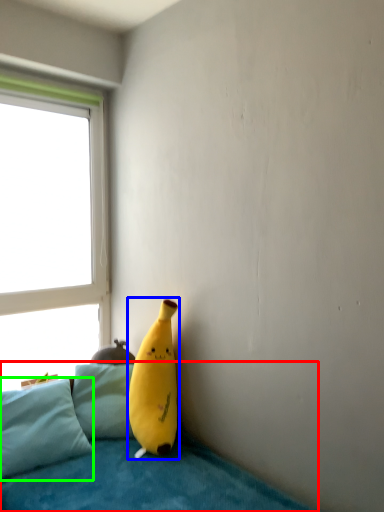
Question: Which object is positioned closest to studio couch (highlighted by a red box)? Select from banana (highlighted by a blue box) and pillow (highlighted by a green box).

Choices:
 (A) banana
 (B) pillow

Answer: (B)